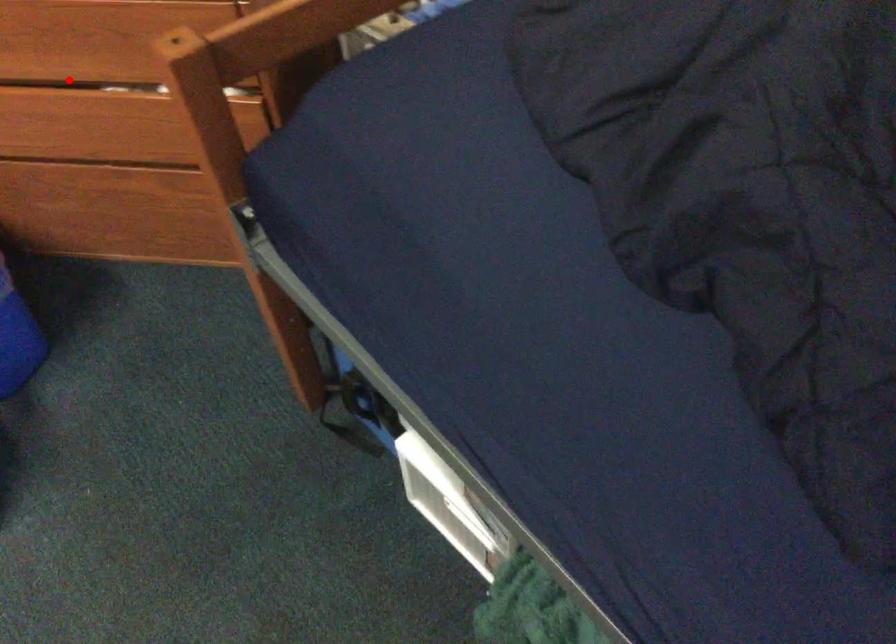
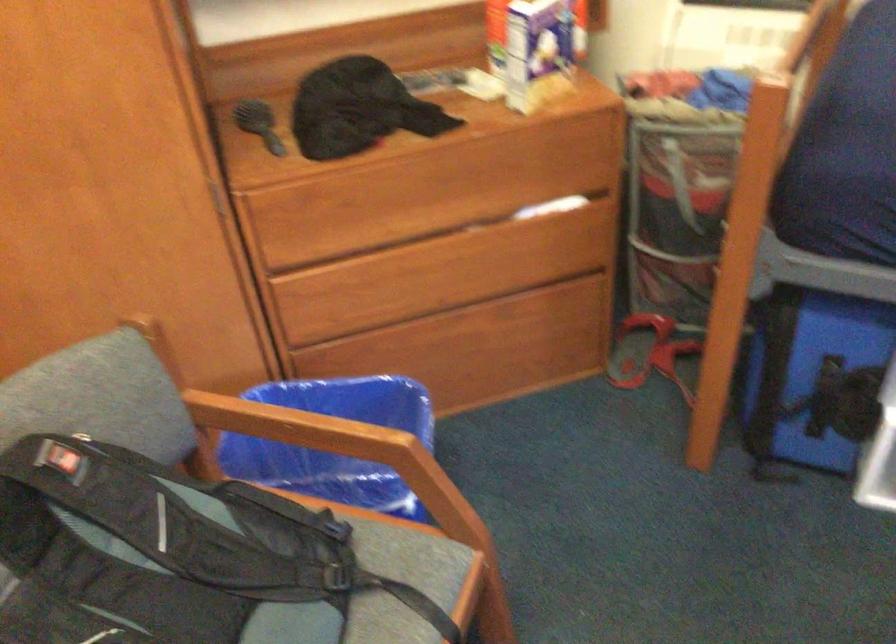
Question: I am providing you with two images of the same scene from different viewpoints. Given a red point in image1, look at the same physical point in image2. Is it:

Choices:
 (A) Closer to the viewpoint
 (B) Farther from the viewpoint

Answer: (B)